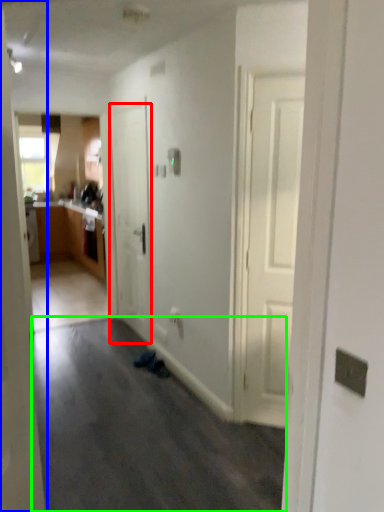
Question: Based on their relative distances, which object is farther from door (highlighted by a red box)? Choose from door (highlighted by a blue box) and plain (highlighted by a green box).

Choices:
 (A) door
 (B) plain

Answer: (A)